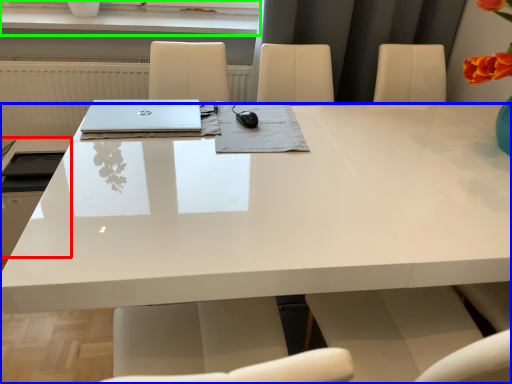
Question: Which object is positioned closest to appliance (highlighted by a red box)? Select from desk (highlighted by a blue box) and window sill (highlighted by a green box).

Choices:
 (A) desk
 (B) window sill

Answer: (A)